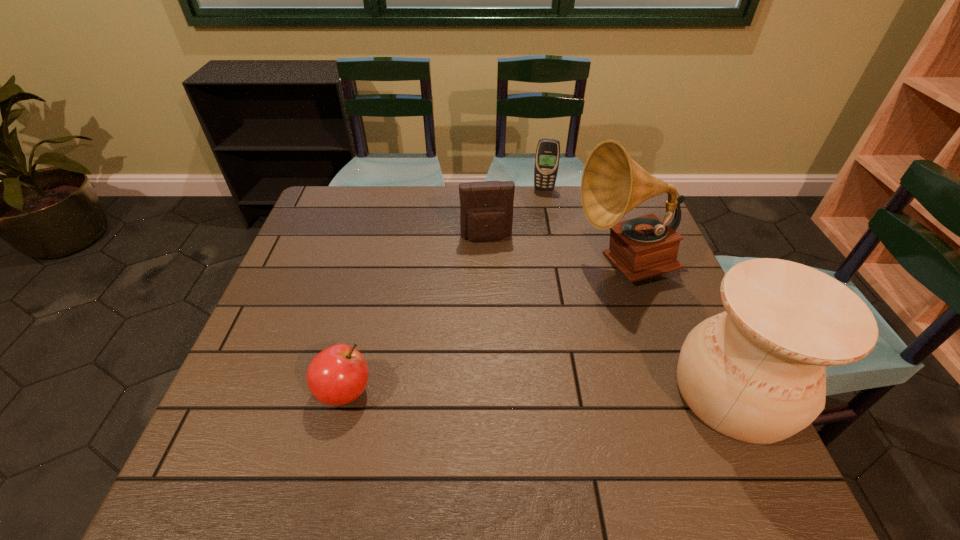
Locate an element on the screen. This screenshot has width=960, height=540. vacant space that is in between the second tallest object and the fourth object from right to left is located at coordinates (610, 315).

Identify the location of free space between the shortest object and the pottery. This screenshot has width=960, height=540. (539, 392).

Locate an element on the screen. The image size is (960, 540). empty location between the pouch and the pottery is located at coordinates (610, 315).

The height and width of the screenshot is (540, 960). I want to click on free space that is in between the apple and the fourth shortest object, so click(539, 392).

Where is `vacant space that is in between the fourth shortest object and the third object from right to left`? vacant space that is in between the fourth shortest object and the third object from right to left is located at coordinates (638, 291).

Find the location of `vacant space that is in between the farthest object and the pouch`. vacant space that is in between the farthest object and the pouch is located at coordinates (516, 214).

Identify the location of blank region between the third object from right to left and the second object from left to right. (516, 214).

Locate which object is the second closest to the leftmost object. Please provide its 2D coordinates. Your answer should be formatted as a tuple, i.e. [(x, y)], where the tuple contains the x and y coordinates of a point satisfying the conditions above.

[(612, 184)]

Identify which object is located as the second nearest to the farthest object. Please provide its 2D coordinates. Your answer should be formatted as a tuple, i.e. [(x, y)], where the tuple contains the x and y coordinates of a point satisfying the conditions above.

[(612, 184)]

I want to click on free point that satisfies the following two spatial constraints: 1. on the front side of the farthest object; 2. on the left side of the tallest object, so click(558, 265).